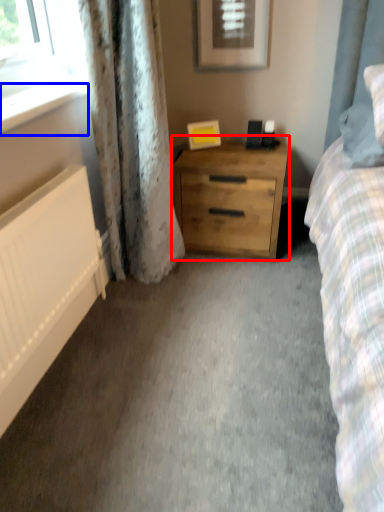
Question: Which of the following is the closest to the observer, chest of drawers (highlighted by a red box) or window sill (highlighted by a blue box)?

Choices:
 (A) chest of drawers
 (B) window sill

Answer: (B)